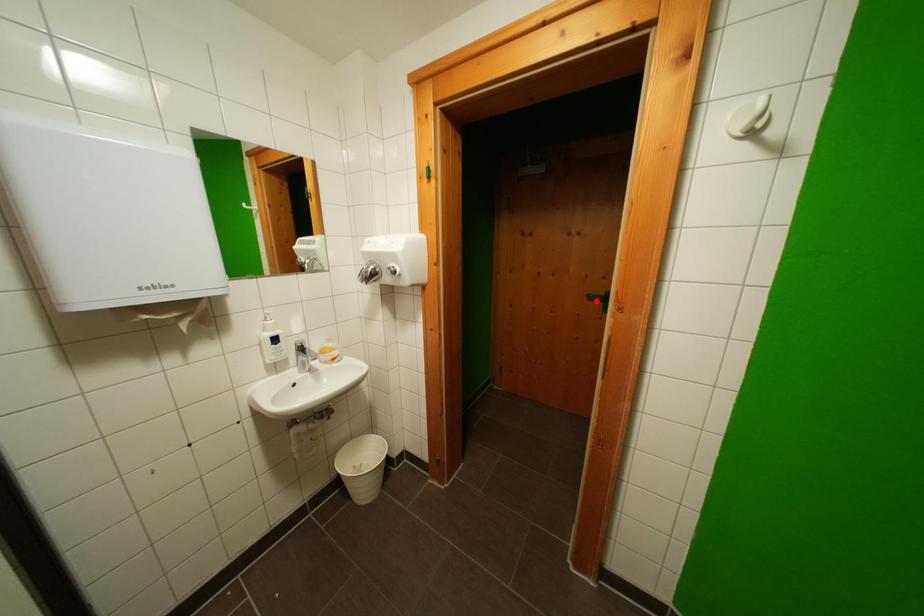
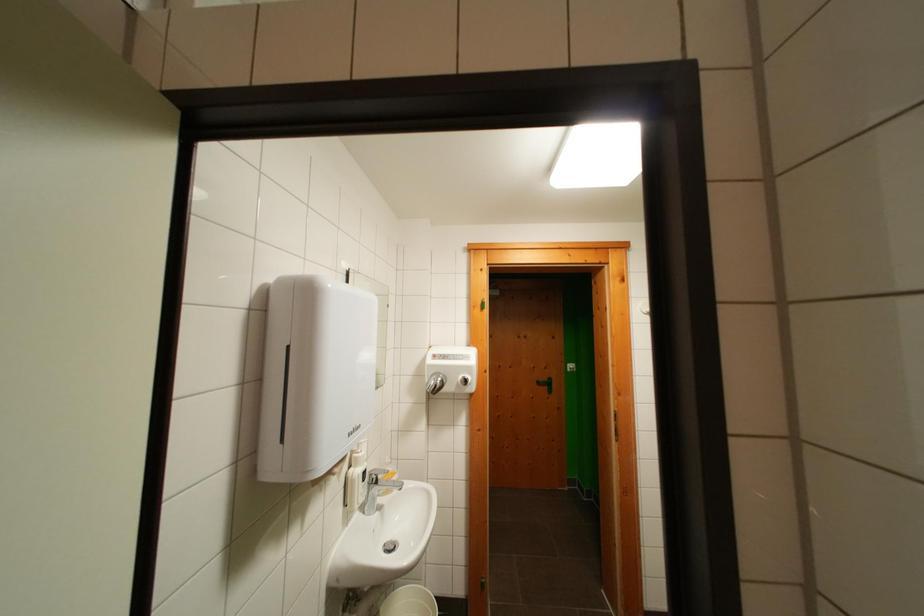
The point at the highlighted location is marked in the first image. Where is the corresponding point in the second image?

(544, 387)